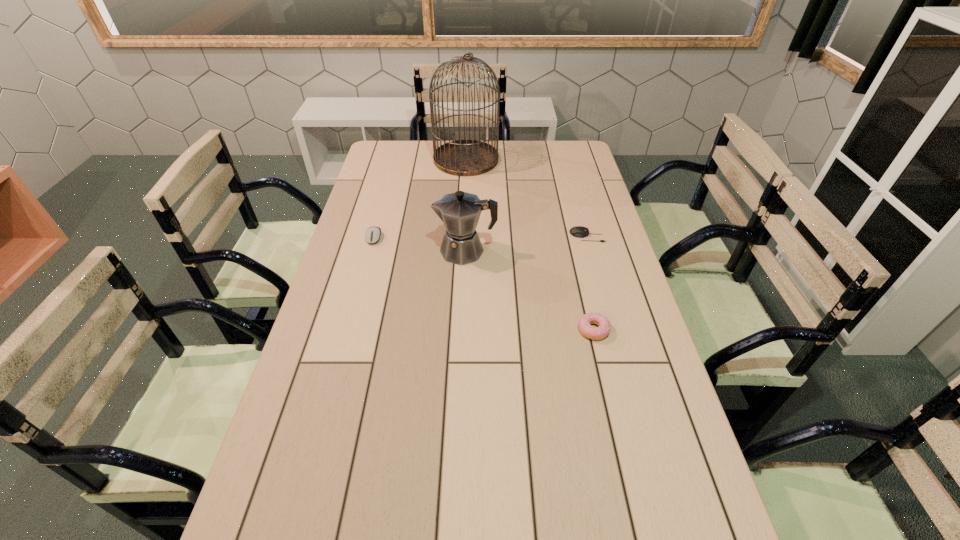
What are the coordinates of `vacant space located 0.270m at the spout of the coffeepot` in the screenshot? It's located at (353, 251).

Identify the location of free location located 0.050m at the spout of the coffeepot. (420, 251).

Locate an element on the screen. This screenshot has height=540, width=960. vacant space located on the back of the nearest object is located at coordinates (580, 272).

Find the location of a particular element. Image resolution: width=960 pixels, height=540 pixels. vacant space situated on the wheel side of the taller mouse is located at coordinates (347, 340).

I want to click on vacant area located 0.400m on the back of the shortest object, so tap(568, 171).

Find the location of a particular element. The width and height of the screenshot is (960, 540). object situated at the far edge is located at coordinates (459, 157).

Find the location of a particular element. The height and width of the screenshot is (540, 960). object situated at the left edge is located at coordinates (372, 235).

The width and height of the screenshot is (960, 540). I want to click on doughnut present at the right edge, so click(595, 333).

You are a GUI agent. You are given a task and a screenshot of the screen. Output one action in this format:
    pyautogui.click(x=<x>, y=<y>)
    Task: Click on the mouse located in the right edge section of the desktop
    The height and width of the screenshot is (540, 960).
    Given the screenshot: What is the action you would take?
    pyautogui.click(x=578, y=231)

Locate an element on the screen. The width and height of the screenshot is (960, 540). vacant area at the left edge is located at coordinates coord(331,446).